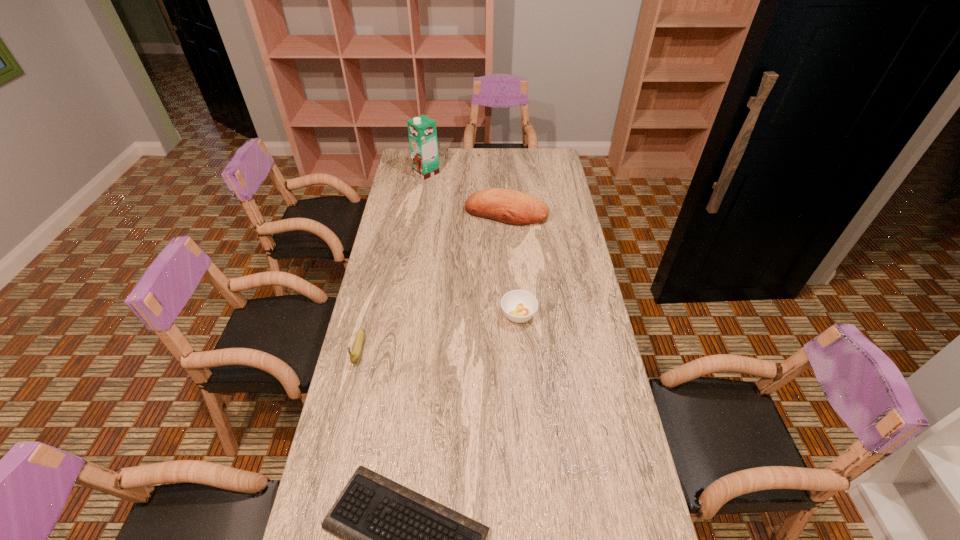
The height and width of the screenshot is (540, 960). I want to click on empty space that is in between the second shortest object and the second farthest object, so click(x=544, y=331).

Locate an element on the screen. The height and width of the screenshot is (540, 960). free point between the bread and the tallest object is located at coordinates (467, 193).

Find the location of a particular element. The width and height of the screenshot is (960, 540). the fourth closest object to the spectacles is located at coordinates (x=512, y=207).

Find the location of a particular element. This screenshot has height=540, width=960. object that is the nearest to the farthest object is located at coordinates (512, 207).